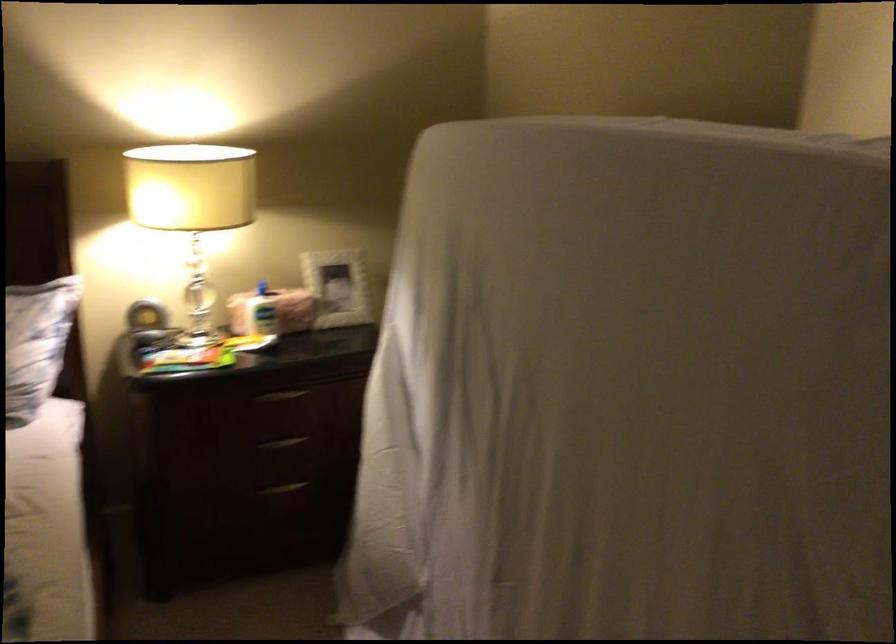
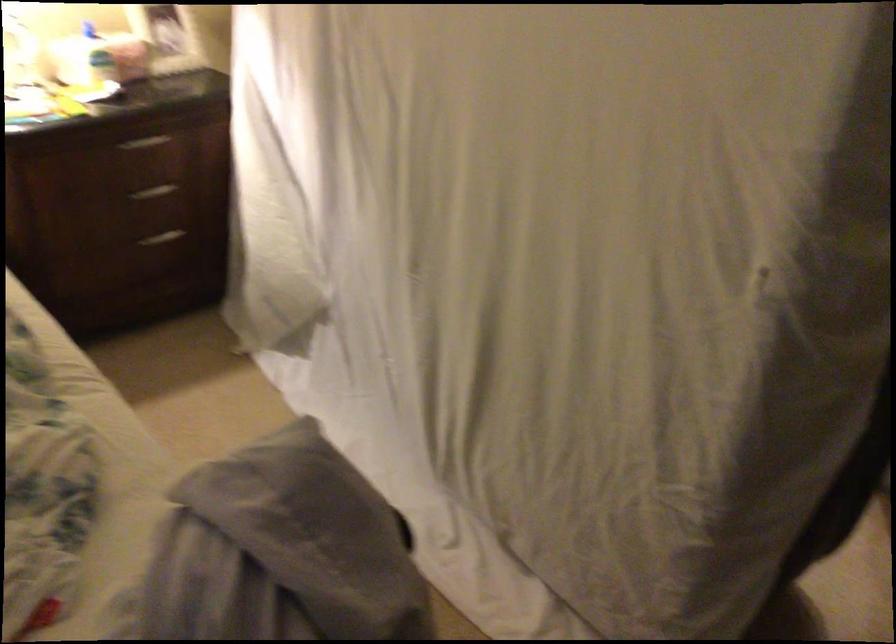
Which direction would the cameraman need to move to produce the second image?

The cameraman walked toward left, backward.